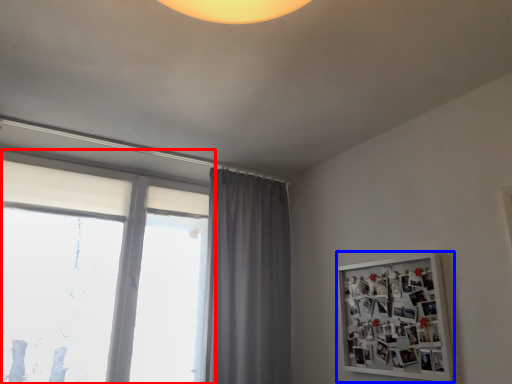
Question: Which object is closer to the camera taking this photo, window (highlighted by a red box) or bulletin board (highlighted by a blue box)?

Choices:
 (A) window
 (B) bulletin board

Answer: (B)